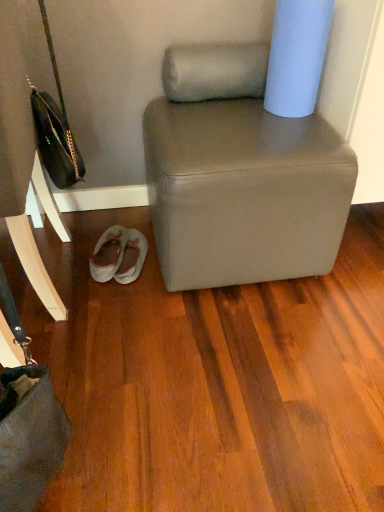
Identify the location of vacant space to the left of light gray suede slippers at lower left. (66, 256).